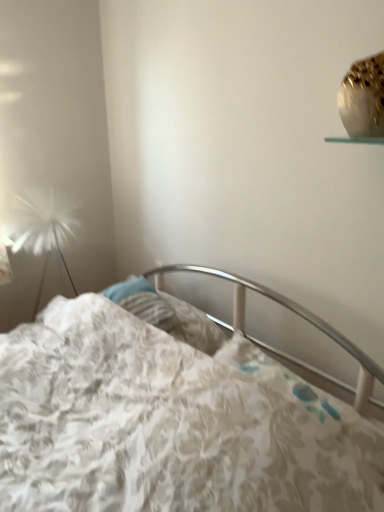
The width and height of the screenshot is (384, 512). In order to click on white fluffy lamp at left in this screenshot , I will do `click(42, 228)`.

What do you see at coordinates (42, 228) in the screenshot? I see `white fluffy lamp at left` at bounding box center [42, 228].

The width and height of the screenshot is (384, 512). I want to click on floral fabric bed at center, so click(169, 416).

This screenshot has width=384, height=512. What do you see at coordinates (169, 416) in the screenshot?
I see `floral fabric bed at center` at bounding box center [169, 416].

Where is `white fluffy lamp at left`? white fluffy lamp at left is located at coordinates (42, 228).

Is white fluffy lamp at left to the left of floral fabric bed at center from the viewer's perspective?

Yes, white fluffy lamp at left is to the left of floral fabric bed at center.

Between white fluffy lamp at left and floral fabric bed at center, which one is positioned behind?

white fluffy lamp at left is further from the camera.

Is point (24, 239) closer to viewer compared to point (283, 478)?

No.

From the image's perspective, is white fluffy lamp at left above or below floral fabric bed at center?

Based on their image positions, white fluffy lamp at left is located above floral fabric bed at center.

From a real-world perspective, is white fluffy lamp at left physically located above or below floral fabric bed at center?

white fluffy lamp at left is above floral fabric bed at center.

Between white fluffy lamp at left and floral fabric bed at center, which one has smaller width?

white fluffy lamp at left is thinner.

Which of these two, white fluffy lamp at left or floral fabric bed at center, stands taller?

floral fabric bed at center.

Looking at this image, is white fluffy lamp at left smaller than floral fabric bed at center?

Yes, white fluffy lamp at left is smaller than floral fabric bed at center.

Could floral fabric bed at center be considered to be inside white fluffy lamp at left?

No.

Is white fluffy lamp at left next to floral fabric bed at center and touching it?

No, white fluffy lamp at left is not making contact with floral fabric bed at center.

Is white fluffy lamp at left turned away from floral fabric bed at center?

No.

What's the angular difference between white fluffy lamp at left and floral fabric bed at center's facing directions?

The angular difference between white fluffy lamp at left and floral fabric bed at center is 92.5 degrees.

Measure the distance from white fluffy lamp at left to floral fabric bed at center.

white fluffy lamp at left is 3.55 feet away from floral fabric bed at center.

In order to click on lamp that appears above the floral fabric bed at center (from the image's perspective) in this screenshot , I will do `click(42, 228)`.

Is floral fabric bed at center to the right of white fluffy lamp at left from the viewer's perspective?

Correct, you'll find floral fabric bed at center to the right of white fluffy lamp at left.

Is the position of floral fabric bed at center less distant than that of white fluffy lamp at left?

Yes, it is in front of white fluffy lamp at left.

Which is nearer, [187,395] or [50,239]?

The point [187,395] is closer.

From the image's perspective, is floral fabric bed at center over white fluffy lamp at left?

No.

From a real-world perspective, is floral fabric bed at center physically located above or below white fluffy lamp at left?

In terms of real-world spatial position, floral fabric bed at center is below white fluffy lamp at left.

Considering the sizes of objects floral fabric bed at center and white fluffy lamp at left in the image provided, who is thinner, floral fabric bed at center or white fluffy lamp at left?

white fluffy lamp at left.

From the picture: Which of these two, floral fabric bed at center or white fluffy lamp at left, stands taller?

floral fabric bed at center.

In the scene shown: Can you confirm if floral fabric bed at center is bigger than white fluffy lamp at left?

Yes, floral fabric bed at center is bigger than white fluffy lamp at left.

Based on the photo, is floral fabric bed at center positioned beyond the bounds of white fluffy lamp at left?

That's correct, floral fabric bed at center is outside of white fluffy lamp at left.

Is floral fabric bed at center not near white fluffy lamp at left?

floral fabric bed at center is far away from white fluffy lamp at left.

Is floral fabric bed at center turned away from white fluffy lamp at left?

No.

What's the angular difference between floral fabric bed at center and white fluffy lamp at left's facing directions?

92.5 degrees separate the facing orientations of floral fabric bed at center and white fluffy lamp at left.

How much distance is there between floral fabric bed at center and white fluffy lamp at left?

floral fabric bed at center and white fluffy lamp at left are 3.55 feet apart from each other.

Image resolution: width=384 pixels, height=512 pixels. In order to click on lamp that appears behind the floral fabric bed at center in this screenshot , I will do [42, 228].

The width and height of the screenshot is (384, 512). I want to click on lamp that is behind the floral fabric bed at center, so click(x=42, y=228).

The image size is (384, 512). I want to click on lamp above the floral fabric bed at center (from the image's perspective), so click(x=42, y=228).